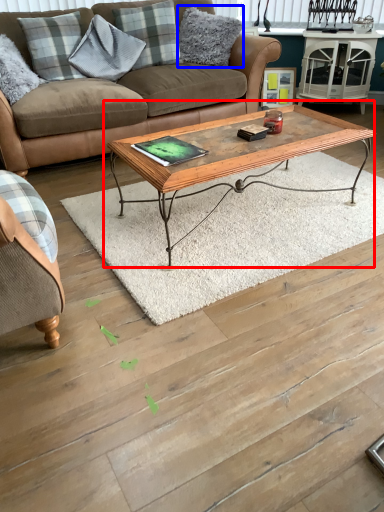
Question: Which object is closer to the camera taking this photo, coffee table (highlighted by a red box) or pillow (highlighted by a blue box)?

Choices:
 (A) coffee table
 (B) pillow

Answer: (A)